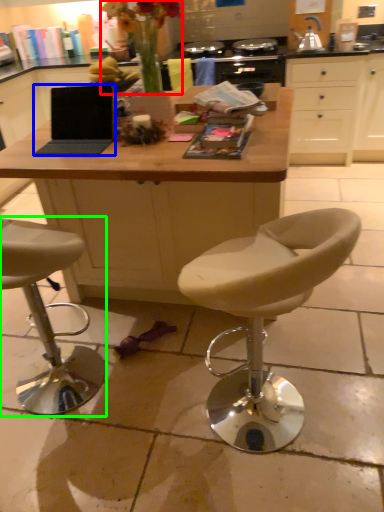
Question: Based on their relative distances, which object is farther from floral arrangement (highlighted by a red box)? Choose from laptop (highlighted by a blue box) and chair (highlighted by a green box).

Choices:
 (A) laptop
 (B) chair

Answer: (B)